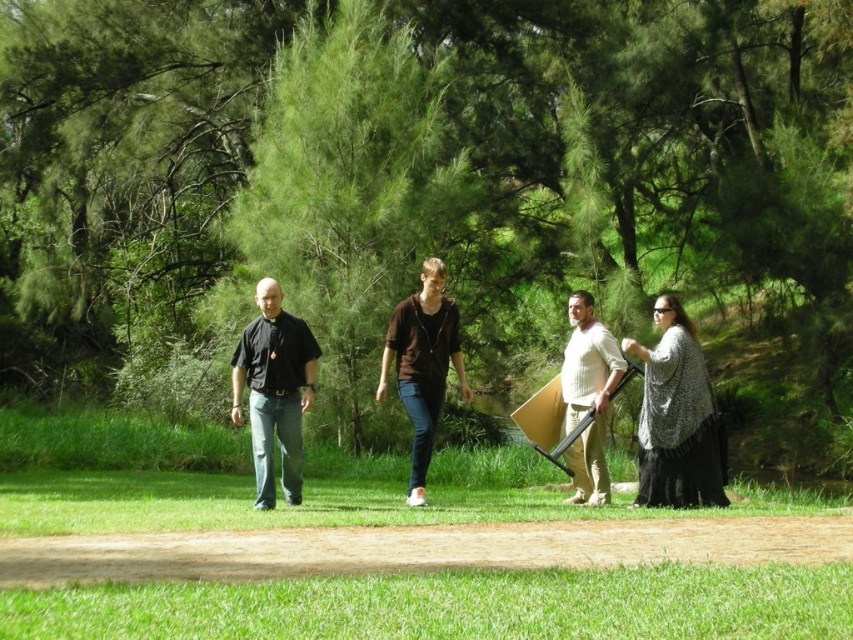
You are a photographer standing on the dirt path and want to take a photo of the two people wearing the brown cotton hoodie at center and the knit sweater at center. Which clothing item will appear bigger in the photo?

The brown cotton hoodie at center will appear bigger in the photo since it has a larger size compared to the knit sweater at center.

You are standing on the dirt path and want to hand a map to both the patterned knit sweater at right and the black matte shirt at left. Which person should you approach first to ensure you can reach them without moving further along the path?

You should approach the patterned knit sweater at right first because they are closer to you than the black matte shirt at left, so you can reach them without moving further along the path.